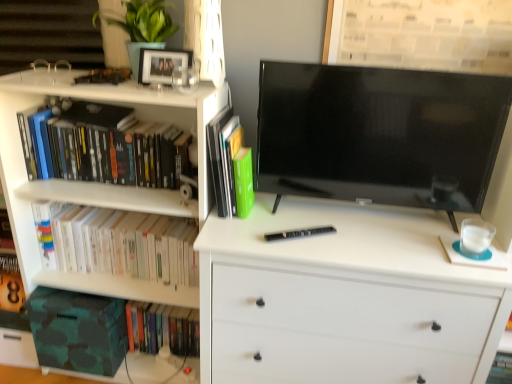
The image size is (512, 384). In order to click on free point in front of black matte pen at center in this screenshot , I will do `click(304, 254)`.